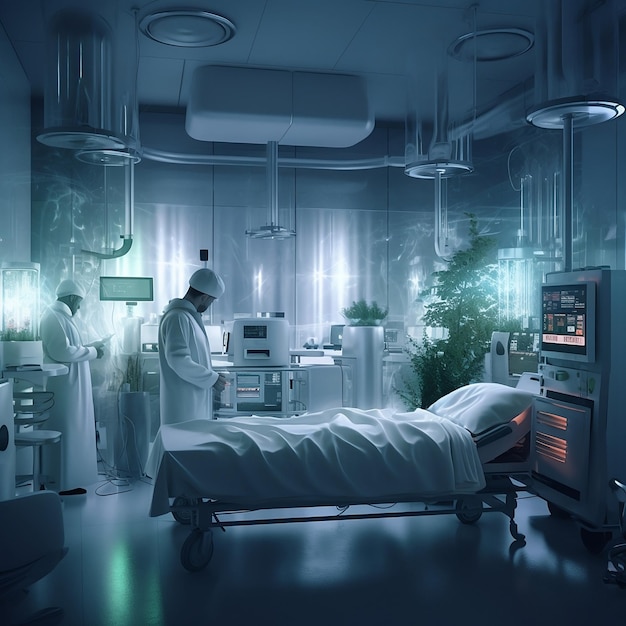
Locate an element on the screen. This screenshot has width=626, height=626. plant is located at coordinates (467, 337).